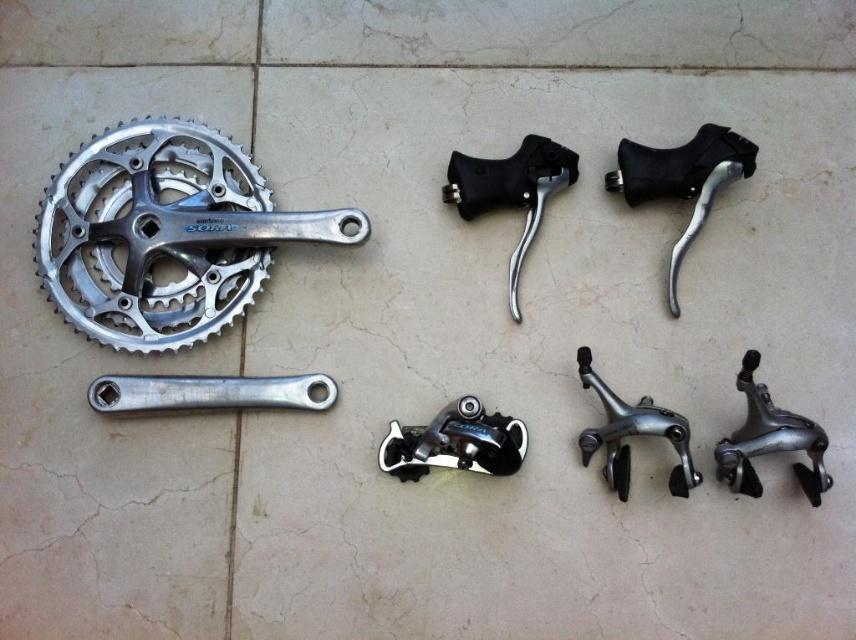
Question: Estimate the real-world distances between objects in this image. Which object is farther from the silver metallic gear at upper left?

Choices:
 (A) silver metallic crank arm at lower left
 (B) polished silver brake caliper at center

Answer: (B)

Question: Can you confirm if black rubber brake lever at upper center is wider than polished silver brake caliper at center?

Choices:
 (A) yes
 (B) no

Answer: (A)

Question: Is silver metallic crank arm at lower left to the right of polished silver brake caliper at center from the viewer's perspective?

Choices:
 (A) yes
 (B) no

Answer: (B)

Question: Estimate the real-world distances between objects in this image. Which object is farther from the black metallic gear at center?

Choices:
 (A) silver metallic brake at lower right
 (B) silver metallic crank arm at lower left
 (C) black rubber brake lever at upper center

Answer: (A)

Question: Among these points, which one is nearest to the camera?

Choices:
 (A) (120, 314)
 (B) (510, 161)

Answer: (A)

Question: Does black rubber brake lever at upper right lie behind silver metallic crank arm at lower left?

Choices:
 (A) yes
 (B) no

Answer: (A)